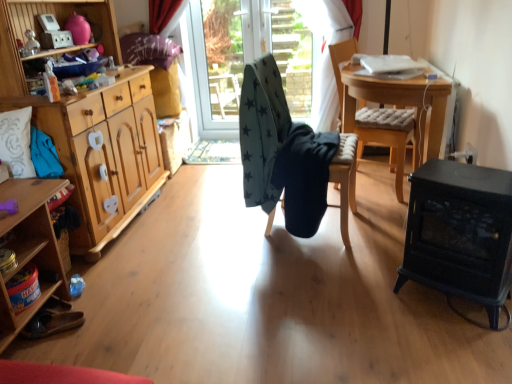
This screenshot has height=384, width=512. What do you see at coordinates (30, 248) in the screenshot?
I see `wooden cabinet at left` at bounding box center [30, 248].

At what (x,y) coordinates should I click in order to perform the action: click on wooden cabinet at left. Please return your answer as a coordinate pair (x, y). This screenshot has width=512, height=384. Looking at the image, I should click on (30, 248).

Locate an element on the screen. brown leather shoes at lower left is located at coordinates (52, 323).

Locate an element on the screen. This screenshot has width=512, height=384. wooden cushioned chair at center, acting as the 3th chair starting from the left is located at coordinates (342, 62).

Identify the location of wooden cabinet at left. (89, 122).

The width and height of the screenshot is (512, 384). I want to click on dark gray fabric at center, so click(x=255, y=52).

The width and height of the screenshot is (512, 384). What are the coordinates of `white embroidered pillow at left` in the screenshot? It's located at click(x=16, y=142).

Where is `wooden cabinet at left`? The image size is (512, 384). wooden cabinet at left is located at coordinates (30, 248).

What's the angular difference between wooden cabinet at left and wooden cushioned chair at center, the 1th chair from the right,'s facing directions?

25.6 degrees.

Consider the image. How much distance is there between wooden cabinet at left and wooden cushioned chair at center, the 1th chair from the right?

wooden cabinet at left and wooden cushioned chair at center, the 1th chair from the right, are 1.84 meters apart from each other.

Which object is further away from the camera taking this photo, wooden cabinet at left or wooden cushioned chair at center, acting as the 3th chair starting from the left?

wooden cushioned chair at center, acting as the 3th chair starting from the left.

From the image's perspective, would you say wooden cabinet at left is positioned over wooden cushioned chair at center, acting as the 3th chair starting from the left?

No.

The width and height of the screenshot is (512, 384). What are the coordinates of `window screen lying behind the brown leather shoes at lower left` in the screenshot? It's located at (255, 52).

Is brown leather shoes at lower left aimed at dark gray fabric at center?

No, brown leather shoes at lower left is not aimed at dark gray fabric at center.

Does point (39, 313) lie behind point (305, 110)?

No, (39, 313) is in front of (305, 110).

Between brown leather shoes at lower left and dark gray fabric at center, which one has smaller width?

dark gray fabric at center is thinner.

Is there a large distance between wooden cushioned chair at center, the 1th chair from the right, and dark blue fabric at center, the second chair in the left-to-right sequence?

No, wooden cushioned chair at center, the 1th chair from the right, is not far away from dark blue fabric at center, the second chair in the left-to-right sequence.

How far apart are wooden cushioned chair at center, acting as the 3th chair starting from the left, and dark blue fabric at center, positioned as the 2th chair in right-to-left order?

A distance of 31.20 inches exists between wooden cushioned chair at center, acting as the 3th chair starting from the left, and dark blue fabric at center, positioned as the 2th chair in right-to-left order.

Starting from the wooden cushioned chair at center, acting as the 3th chair starting from the left, which chair is the 1st one to the left? Please provide its 2D coordinates.

[(345, 180)]

How different are the orientations of wooden cushioned chair at center, the 1th chair from the right, and dark blue fabric at center, the second chair in the left-to-right sequence, in degrees?

The facing directions of wooden cushioned chair at center, the 1th chair from the right, and dark blue fabric at center, the second chair in the left-to-right sequence, are 15.8 degrees apart.

From the image's perspective, is wooden cabinet at left above or below white embroidered pillow at left?

wooden cabinet at left is situated higher than white embroidered pillow at left in the image.

Considering the relative positions of wooden cabinet at left and white embroidered pillow at left in the image provided, is wooden cabinet at left in front of white embroidered pillow at left?

Yes.

Looking at this image, which point is more distant from viewer, [138,165] or [7,134]?

The point [138,165] is farther from the camera.

Locate an element on the screen. Image resolution: width=512 pixels, height=384 pixels. cabinetry that appears in front of the white embroidered pillow at left is located at coordinates (89, 122).

Is wooden table at center inside the boundaries of white embroidered pillow at left, or outside?

The correct answer is: outside.

The width and height of the screenshot is (512, 384). Identify the location of table that appears above the white embroidered pillow at left (from the image's perspective). (396, 115).

Considering the positions of objects wooden table at center and white embroidered pillow at left in the image provided, who is more to the right, wooden table at center or white embroidered pillow at left?

From the viewer's perspective, wooden table at center appears more on the right side.

In the scene shown: How distant is wooden table at center from dark blue fabric at center, positioned as the 2th chair in right-to-left order?

wooden table at center and dark blue fabric at center, positioned as the 2th chair in right-to-left order, are 18.34 inches apart from each other.

Would you say wooden table at center is outside dark blue fabric at center, the second chair in the left-to-right sequence?

Yes, wooden table at center is located beyond the bounds of dark blue fabric at center, the second chair in the left-to-right sequence.

Can you confirm if wooden table at center is positioned to the left of dark blue fabric at center, positioned as the 2th chair in right-to-left order?

In fact, wooden table at center is to the right of dark blue fabric at center, positioned as the 2th chair in right-to-left order.

How different are the orientations of wooden table at center and dark blue fabric at center, positioned as the 2th chair in right-to-left order, in degrees?

10.1 degrees.

Who is taller, dark gray fabric at center or white embroidered pillow at left?

dark gray fabric at center is taller.

From the picture: Between dark gray fabric at center and white embroidered pillow at left, which one appears on the right side from the viewer's perspective?

Positioned to the right is dark gray fabric at center.

Is dark gray fabric at center facing away from white embroidered pillow at left?

No, dark gray fabric at center is not facing the opposite direction of white embroidered pillow at left.

Is dark gray fabric at center far from white embroidered pillow at left?

Yes, dark gray fabric at center is far from white embroidered pillow at left.

Image resolution: width=512 pixels, height=384 pixels. I want to click on chair that is the 3rd object above the wooden cabinet at left (from a real-world perspective), so click(342, 62).

Find the location of a particular element. This screenshot has height=384, width=512. footwear below the dark gray fabric at center (from the image's perspective) is located at coordinates (52, 323).

Based on their spatial positions, is black cast iron fireplace at lower right or dark blue fabric at center, the second chair in the left-to-right sequence, further from wooden cabinet at left?

black cast iron fireplace at lower right is further to wooden cabinet at left.

Which object lies further to the anchor point teal star-patterned fabric at center, placed as the third chair when sorted from right to left, dark gray fabric at center or wooden cushioned chair at center, acting as the 3th chair starting from the left?

dark gray fabric at center.

Looking at the image, which one is located closer to wooden cushioned chair at center, the 1th chair from the right, black cast iron fireplace at lower right or white embroidered pillow at left?

Among the two, black cast iron fireplace at lower right is located nearer to wooden cushioned chair at center, the 1th chair from the right.

In the scene shown: Looking at the image, which one is located further to wooden cabinet at left, brown leather shoes at lower left or wooden cabinet at left?

wooden cabinet at left.

Which object lies nearer to the anchor point wooden cabinet at left, teal star-patterned fabric at center, placed as the third chair when sorted from right to left, or dark blue fabric at center, positioned as the 2th chair in right-to-left order?

teal star-patterned fabric at center, placed as the third chair when sorted from right to left, is closer to wooden cabinet at left.

From the image, which object appears to be farther from dark blue fabric at center, positioned as the 2th chair in right-to-left order, black cast iron fireplace at lower right or teal star-patterned fabric at center, which ranks as the first chair in left-to-right order?

Based on the image, black cast iron fireplace at lower right appears to be further to dark blue fabric at center, positioned as the 2th chair in right-to-left order.

Which object lies further to the anchor point black cast iron fireplace at lower right, brown leather shoes at lower left or teal star-patterned fabric at center, which ranks as the first chair in left-to-right order?

brown leather shoes at lower left.

From the picture: Estimate the real-world distances between objects in this image. Which object is closer to dark gray fabric at center, wooden cabinet at left or brown leather shoes at lower left?

wooden cabinet at left.

Image resolution: width=512 pixels, height=384 pixels. Find the location of `desk between white embroidered pillow at left and dark blue fabric at center, positioned as the 2th chair in right-to-left order`. desk between white embroidered pillow at left and dark blue fabric at center, positioned as the 2th chair in right-to-left order is located at coordinates (30, 248).

This screenshot has height=384, width=512. What are the coordinates of `footwear located between white embroidered pillow at left and dark blue fabric at center, positioned as the 2th chair in right-to-left order, in the left-right direction` in the screenshot? It's located at (52, 323).

At what (x,y) coordinates should I click in order to perform the action: click on footwear between wooden cabinet at left and black cast iron fireplace at lower right from left to right. Please return your answer as a coordinate pair (x, y). The width and height of the screenshot is (512, 384). Looking at the image, I should click on (52, 323).

Locate an element on the screen. The image size is (512, 384). footwear between black cast iron fireplace at lower right and dark gray fabric at center in the front-back direction is located at coordinates (52, 323).